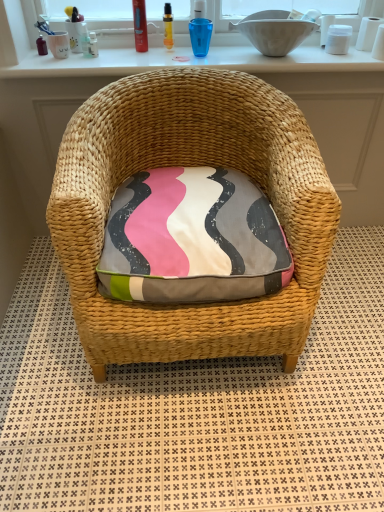
What do you see at coordinates (192, 239) in the screenshot? The height and width of the screenshot is (512, 384). I see `textured cotton cushion at center` at bounding box center [192, 239].

From the picture: In order to face translucent plastic toothbrush at upper center, the third toiletry when ordered from right to left, should I rotate leftwards or rightwards?

It's best to rotate left around 13.204 degrees.

I want to click on translucent plastic vial at upper center, the 1th toiletry positioned from the right, so click(168, 26).

What do you see at coordinates (191, 62) in the screenshot? Image resolution: width=384 pixels, height=512 pixels. I see `white glossy window sill at upper center` at bounding box center [191, 62].

You are a GUI agent. You are given a task and a screenshot of the screen. Output one action in this format:
    pyautogui.click(x=<x>, y=<y>)
    Task: Click on the natural woven chair at center
    
    Given the screenshot: What is the action you would take?
    pyautogui.click(x=328, y=114)

Find the location of a particular element. textured cotton cushion at center is located at coordinates (192, 239).

Choose the correct answer: Is shiny red can at upper center, marked as the second toiletry in a left-to-right arrangement, inside translucent plastic vial at upper center, which is the 3th toiletry from left to right, or outside it?

shiny red can at upper center, marked as the second toiletry in a left-to-right arrangement, cannot be found inside translucent plastic vial at upper center, which is the 3th toiletry from left to right.

Is shiny red can at upper center, marked as the 2th toiletry in a right-to-left arrangement, oriented away from translucent plastic vial at upper center, which is the 3th toiletry from left to right?

shiny red can at upper center, marked as the 2th toiletry in a right-to-left arrangement, is not turned away from translucent plastic vial at upper center, which is the 3th toiletry from left to right.

Does shiny red can at upper center, marked as the second toiletry in a left-to-right arrangement, have a lesser width compared to translucent plastic vial at upper center, the 1th toiletry positioned from the right?

Incorrect, the width of shiny red can at upper center, marked as the second toiletry in a left-to-right arrangement, is not less than that of translucent plastic vial at upper center, the 1th toiletry positioned from the right.

Considering the positions of points (141, 1) and (168, 8), is point (141, 1) closer to camera compared to point (168, 8)?

Yes, it is.

From their relative heights in the image, would you say woven straw chair at center is taller or shorter than natural woven chair at center?

woven straw chair at center is shorter than natural woven chair at center.

Is point (284, 405) positioned behind point (28, 124)?

No.

From the image's perspective, is woven straw chair at center beneath natural woven chair at center?

Yes.

Does natural woven chair at center have a smaller size compared to white glossy window sill at upper center?

Actually, natural woven chair at center might be larger than white glossy window sill at upper center.

From a real-world perspective, is natural woven chair at center located higher than white glossy window sill at upper center?

No.

How much distance is there between natural woven chair at center and white glossy window sill at upper center?

natural woven chair at center and white glossy window sill at upper center are 48.12 centimeters apart from each other.

Is natural woven chair at center directly adjacent to white glossy window sill at upper center?

They are not placed beside each other.

Considering the sizes of objects translucent plastic toothbrush at upper center, the 1th toiletry from the left, and white ceramic bowl at upper center in the image provided, who is thinner, translucent plastic toothbrush at upper center, the 1th toiletry from the left, or white ceramic bowl at upper center?

translucent plastic toothbrush at upper center, the 1th toiletry from the left, is thinner.

Based on the photo, is translucent plastic toothbrush at upper center, the 1th toiletry from the left, inside the boundaries of white ceramic bowl at upper center, or outside?

translucent plastic toothbrush at upper center, the 1th toiletry from the left, is located beyond the bounds of white ceramic bowl at upper center.

Is translucent plastic toothbrush at upper center, the 1th toiletry from the left, taller than white ceramic bowl at upper center?

No, translucent plastic toothbrush at upper center, the 1th toiletry from the left, is not taller than white ceramic bowl at upper center.

From a real-world perspective, does translucent plastic toothbrush at upper center, the third toiletry when ordered from right to left, sit lower than white ceramic bowl at upper center?

Yes, from a real-world perspective, translucent plastic toothbrush at upper center, the third toiletry when ordered from right to left, is under white ceramic bowl at upper center.

From the image's perspective, which is above, white ceramic bowl at upper center or shiny red can at upper center, marked as the 2th toiletry in a right-to-left arrangement?

shiny red can at upper center, marked as the 2th toiletry in a right-to-left arrangement, appears higher in the image.

Is white ceramic bowl at upper center far from shiny red can at upper center, marked as the second toiletry in a left-to-right arrangement?

No.

Image resolution: width=384 pixels, height=512 pixels. Find the location of `the 2nd toiletry to the left when counting from the white ceramic bowl at upper center`. the 2nd toiletry to the left when counting from the white ceramic bowl at upper center is located at coordinates (140, 25).

Would you say textured cotton cushion at center contains translucent plastic toothbrush at upper center, the 1th toiletry from the left?

No, translucent plastic toothbrush at upper center, the 1th toiletry from the left, is not inside textured cotton cushion at center.

The width and height of the screenshot is (384, 512). What are the coordinates of `throw pillow that is under the translucent plastic toothbrush at upper center, the third toiletry when ordered from right to left (from a real-world perspective)` in the screenshot? It's located at (192, 239).

From the image's perspective, which is below, textured cotton cushion at center or translucent plastic toothbrush at upper center, the third toiletry when ordered from right to left?

textured cotton cushion at center, from the image's perspective.

Which of these two, textured cotton cushion at center or translucent plastic toothbrush at upper center, the 1th toiletry from the left, stands taller?

Standing taller between the two is textured cotton cushion at center.

Which object is positioned more to the right, translucent plastic toothbrush at upper center, the 1th toiletry from the left, or shiny red can at upper center, marked as the 2th toiletry in a right-to-left arrangement?

shiny red can at upper center, marked as the 2th toiletry in a right-to-left arrangement.

From the image's perspective, is translucent plastic toothbrush at upper center, the third toiletry when ordered from right to left, located above or below shiny red can at upper center, marked as the 2th toiletry in a right-to-left arrangement?

Clearly, from the image's perspective, translucent plastic toothbrush at upper center, the third toiletry when ordered from right to left, is below shiny red can at upper center, marked as the 2th toiletry in a right-to-left arrangement.

At what (x,y) coordinates should I click in order to perform the action: click on toiletry located in front of the translucent plastic toothbrush at upper center, the 1th toiletry from the left. Please return your answer as a coordinate pair (x, y). Looking at the image, I should click on (140, 25).

Based on the photo, considering the sizes of translucent plastic toothbrush at upper center, the 1th toiletry from the left, and shiny red can at upper center, marked as the 2th toiletry in a right-to-left arrangement, in the image, is translucent plastic toothbrush at upper center, the 1th toiletry from the left, bigger or smaller than shiny red can at upper center, marked as the 2th toiletry in a right-to-left arrangement,?

In the image, translucent plastic toothbrush at upper center, the 1th toiletry from the left, appears to be smaller than shiny red can at upper center, marked as the 2th toiletry in a right-to-left arrangement.

From the translucent plastic vial at upper center, which is the 3th toiletry from left to right, count the 1st toiletry to the left and point to it. Please provide its 2D coordinates.

[(140, 25)]

Locate an element on the screen. This screenshot has width=384, height=512. vanity lying above the woven straw chair at center (from the image's perspective) is located at coordinates (328, 114).

Looking at the image, which one is located closer to shiny red can at upper center, marked as the second toiletry in a left-to-right arrangement, white ceramic bowl at upper center or translucent plastic toothbrush at upper center, the third toiletry when ordered from right to left?

Among the two, translucent plastic toothbrush at upper center, the third toiletry when ordered from right to left, is located nearer to shiny red can at upper center, marked as the second toiletry in a left-to-right arrangement.

Estimate the real-world distances between objects in this image. Which object is further from woven straw chair at center, white glossy window sill at upper center or natural woven chair at center?

Based on the image, white glossy window sill at upper center appears to be further to woven straw chair at center.

From the image, which object appears to be nearer to white glossy window sill at upper center, translucent plastic toothbrush at upper center, the 1th toiletry from the left, or translucent plastic vial at upper center, which is the 3th toiletry from left to right?

translucent plastic vial at upper center, which is the 3th toiletry from left to right, is closer to white glossy window sill at upper center.

Considering their positions, is woven straw chair at center positioned closer to shiny red can at upper center, marked as the second toiletry in a left-to-right arrangement, than white ceramic bowl at upper center?

white ceramic bowl at upper center.

Which object lies nearer to the anchor point natural woven chair at center, textured cotton cushion at center or white glossy window sill at upper center?

white glossy window sill at upper center is positioned closer to the anchor natural woven chair at center.

Considering their positions, is natural woven chair at center positioned closer to textured cotton cushion at center than shiny red can at upper center, marked as the 2th toiletry in a right-to-left arrangement?

natural woven chair at center is closer to textured cotton cushion at center.

Looking at this image, looking at the image, which one is located further to natural woven chair at center, white ceramic bowl at upper center or natural woven chair at center?

white ceramic bowl at upper center lies further to natural woven chair at center than the other object.

Which object lies further to the anchor point translucent plastic vial at upper center, which is the 3th toiletry from left to right, shiny red can at upper center, marked as the 2th toiletry in a right-to-left arrangement, or natural woven chair at center?

natural woven chair at center is further to translucent plastic vial at upper center, which is the 3th toiletry from left to right.

You are a GUI agent. You are given a task and a screenshot of the screen. Output one action in this format:
    pyautogui.click(x=<x>, y=<y>)
    Task: Click on the window sill that lies between shiny red can at upper center, marked as the second toiletry in a left-to-right arrangement, and textured cotton cushion at center from top to bottom
    The image size is (384, 512).
    Given the screenshot: What is the action you would take?
    pyautogui.click(x=191, y=62)

Find the location of a particular element. The width and height of the screenshot is (384, 512). chair that lies between translucent plastic toothbrush at upper center, the third toiletry when ordered from right to left, and woven straw chair at center from top to bottom is located at coordinates (191, 164).

Identify the location of vanity between translucent plastic vial at upper center, which is the 3th toiletry from left to right, and woven straw chair at center, in the vertical direction. (328, 114).

You are a GUI agent. You are given a task and a screenshot of the screen. Output one action in this format:
    pyautogui.click(x=<x>, y=<y>)
    Task: Click on the toiletry between translucent plastic vial at upper center, which is the 3th toiletry from left to right, and natural woven chair at center from top to bottom
    This screenshot has width=384, height=512.
    Given the screenshot: What is the action you would take?
    click(93, 44)